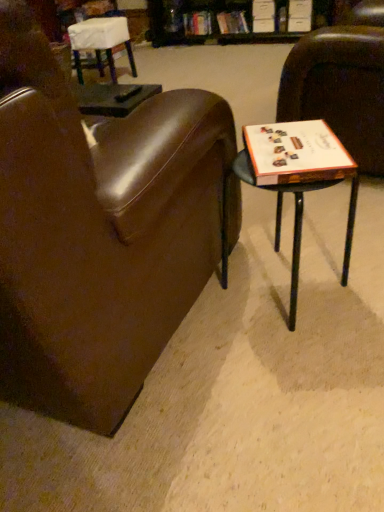
Question: Is hardcover book at upper center, acting as the 2th book starting from the right, inside or outside of brown leather chair at center, which is the 2th chair in right-to-left order?

Choices:
 (A) inside
 (B) outside

Answer: (B)

Question: From the image's perspective, is hardcover book at upper center, the 1th book in the left-to-right sequence, above or below brown leather chair at center, which ranks as the first chair in front-to-back order?

Choices:
 (A) below
 (B) above

Answer: (B)

Question: Estimate the real-world distances between objects in this image. Which object is farther from the hardcover book at upper center, the 1th book in the left-to-right sequence?

Choices:
 (A) brown leather chair at center, which is the 2th chair in right-to-left order
 (B) white paper at right
 (C) white fabric-covered chair at upper left, acting as the 1th chair starting from the left
 (D) hardcover book at upper center, marked as the 1th book in a right-to-left arrangement
 (E) brown leather chair at right, the first chair in the right-to-left sequence

Answer: (A)

Question: Which object is positioned farthest from the brown leather chair at center, which appears as the second chair when viewed from the left?

Choices:
 (A) wooden table at right
 (B) brown leather chair at right, the 3th chair positioned from the left
 (C) white paper at right
 (D) hardcover book at upper center, placed as the second book when sorted from left to right
 (E) wooden bookshelf at upper center

Answer: (D)